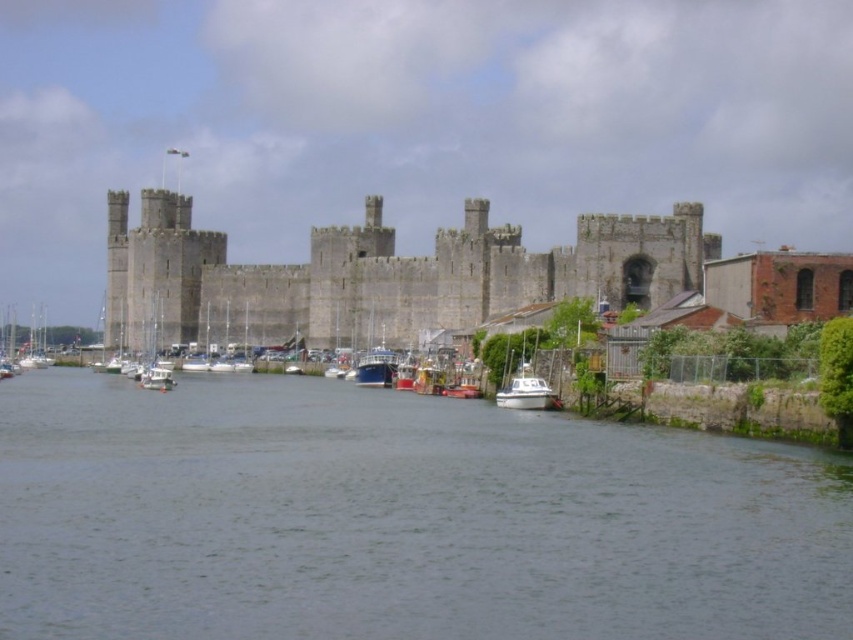
You are standing on the shore of the waterfront and see the gray concrete water at lower center and the white glossy boat at lower right. Which object is positioned to the left of the other?

The gray concrete water at lower center is positioned to the left of the white glossy boat at lower right.

You are a tourist standing on the dock and want to take a photo of the gray concrete water at lower center and the white glossy boat at lower right. Which object should you focus on first if you want to include both in your shot without moving the camera?

You should focus on the gray concrete water at lower center first because it is positioned under the white glossy boat at lower right, ensuring both are in frame without needing to adjust the camera position.